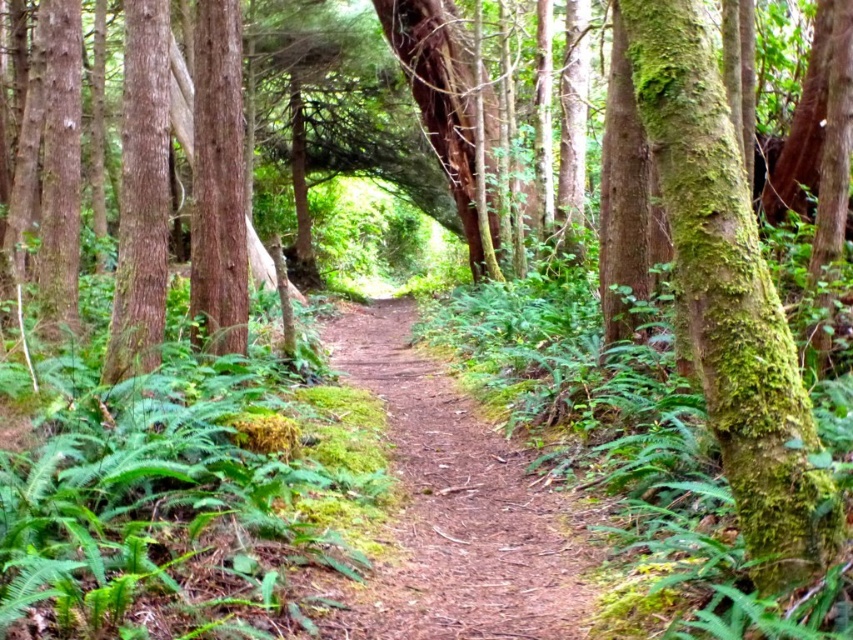
Question: Which of the following is the closest to the observer?

Choices:
 (A) (403, 452)
 (B) (730, 484)

Answer: (B)

Question: Is green mossy bark tree at right positioned in front of brown dirt path at center?

Choices:
 (A) no
 (B) yes

Answer: (B)

Question: Which point appears closest to the camera in this image?

Choices:
 (A) (734, 230)
 (B) (444, 564)

Answer: (A)

Question: Is green mossy bark tree at right closer to the viewer compared to brown dirt path at center?

Choices:
 (A) yes
 (B) no

Answer: (A)

Question: Where is green mossy bark tree at right located in relation to brown dirt path at center in the image?

Choices:
 (A) above
 (B) below

Answer: (A)